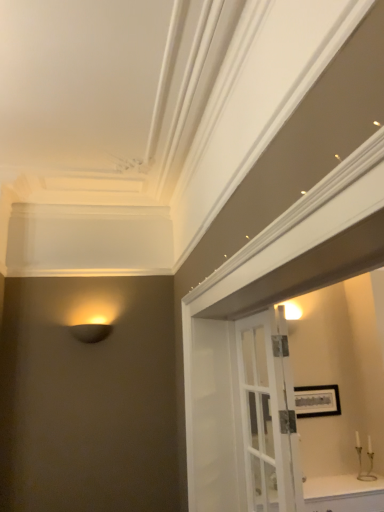
Question: Is white glossy cabinet at lower right closer to camera compared to matte black lamp at left?

Choices:
 (A) yes
 (B) no

Answer: (A)

Question: Considering the relative positions of white glossy cabinet at lower right and matte black lamp at left in the image provided, is white glossy cabinet at lower right to the left of matte black lamp at left from the viewer's perspective?

Choices:
 (A) yes
 (B) no

Answer: (B)

Question: Does white glossy cabinet at lower right appear on the right side of matte black lamp at left?

Choices:
 (A) yes
 (B) no

Answer: (A)

Question: From a real-world perspective, does white glossy cabinet at lower right sit lower than matte black lamp at left?

Choices:
 (A) yes
 (B) no

Answer: (A)

Question: From the image's perspective, would you say white glossy cabinet at lower right is positioned over matte black lamp at left?

Choices:
 (A) no
 (B) yes

Answer: (A)

Question: Is white glossy cabinet at lower right taller than matte black lamp at left?

Choices:
 (A) yes
 (B) no

Answer: (A)

Question: Does matte black lamp at left lie in front of metallic gold candle holder at lower right?

Choices:
 (A) yes
 (B) no

Answer: (A)

Question: Considering the relative positions of matte black lamp at left and metallic gold candle holder at lower right in the image provided, is matte black lamp at left to the left of metallic gold candle holder at lower right from the viewer's perspective?

Choices:
 (A) yes
 (B) no

Answer: (A)

Question: Does matte black lamp at left have a larger size compared to metallic gold candle holder at lower right?

Choices:
 (A) no
 (B) yes

Answer: (B)

Question: Is matte black lamp at left shorter than metallic gold candle holder at lower right?

Choices:
 (A) no
 (B) yes

Answer: (B)

Question: From the image's perspective, is matte black lamp at left under metallic gold candle holder at lower right?

Choices:
 (A) no
 (B) yes

Answer: (A)

Question: Is matte black lamp at left turned away from metallic gold candle holder at lower right?

Choices:
 (A) yes
 (B) no

Answer: (B)

Question: Is metallic gold candle holder at lower right turned away from white glass door at center?

Choices:
 (A) no
 (B) yes

Answer: (A)